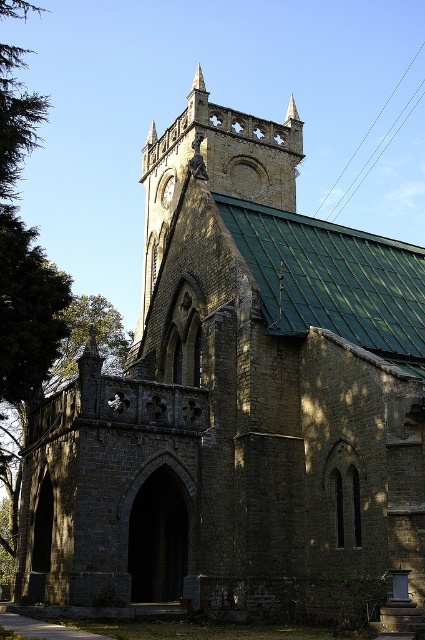
Question: Which point is farther from the camera taking this photo?

Choices:
 (A) (108, 339)
 (B) (166, 200)

Answer: (A)

Question: Which of the following is the closest to the observer?

Choices:
 (A) (167, 202)
 (B) (81, 328)

Answer: (A)

Question: Is green leafy tree at left thinner than gold textured clock at upper center?

Choices:
 (A) no
 (B) yes

Answer: (A)

Question: Is green leafy tree at left wider than gold textured clock at upper center?

Choices:
 (A) no
 (B) yes

Answer: (B)

Question: Which object is closer to the camera taking this photo?

Choices:
 (A) gold textured clock at upper center
 (B) green leafy tree at left

Answer: (B)

Question: Is green leafy tree at left to the left of gold textured clock at upper center from the viewer's perspective?

Choices:
 (A) no
 (B) yes

Answer: (B)